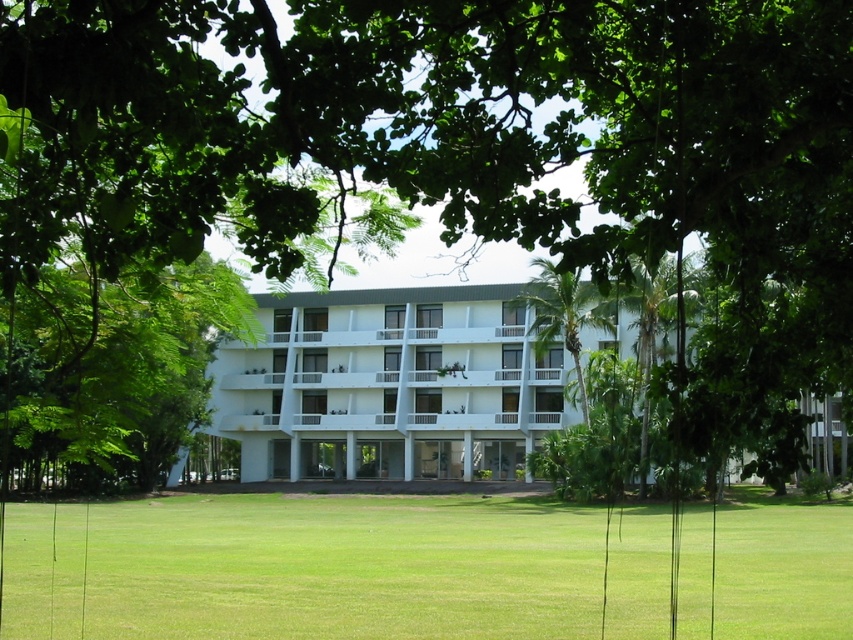
Question: Among these points, which one is farthest from the camera?

Choices:
 (A) (664, 515)
 (B) (274, 432)
 (C) (120, 296)

Answer: (B)

Question: Which point is farther from the camera taking this photo?

Choices:
 (A) (161, 372)
 (B) (74, 605)
 (C) (534, 296)

Answer: (C)

Question: Which object appears closest to the camera in this image?

Choices:
 (A) white glossy building at center
 (B) green leafy palm tree at center
 (C) green leafy tree at center

Answer: (C)

Question: Does green grass at center appear on the right side of green leafy tree at center?

Choices:
 (A) no
 (B) yes

Answer: (B)

Question: Can you confirm if green grass at center is thinner than green leafy tree at center?

Choices:
 (A) yes
 (B) no

Answer: (B)

Question: Is green grass at center thinner than green leafy palm tree at center?

Choices:
 (A) yes
 (B) no

Answer: (B)